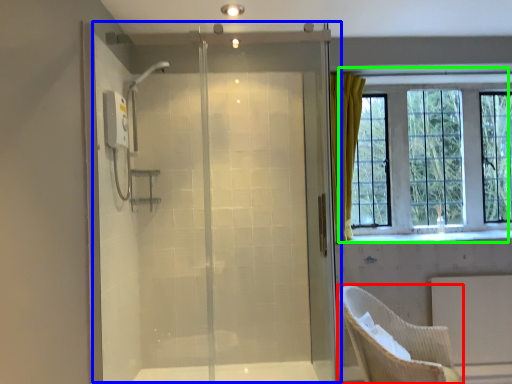
Question: Based on their relative distances, which object is farther from chair (highlighted by a red box)? Choose from screen door (highlighted by a blue box) and window (highlighted by a green box).

Choices:
 (A) screen door
 (B) window

Answer: (B)